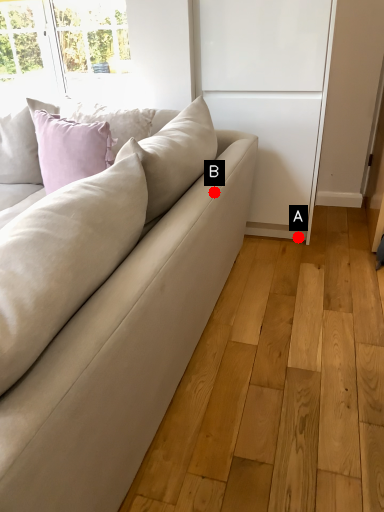
Question: Two points are circled on the image, labeled by A and B beside each circle. Which point appears closest to the camera in this image?

Choices:
 (A) A is closer
 (B) B is closer

Answer: (B)